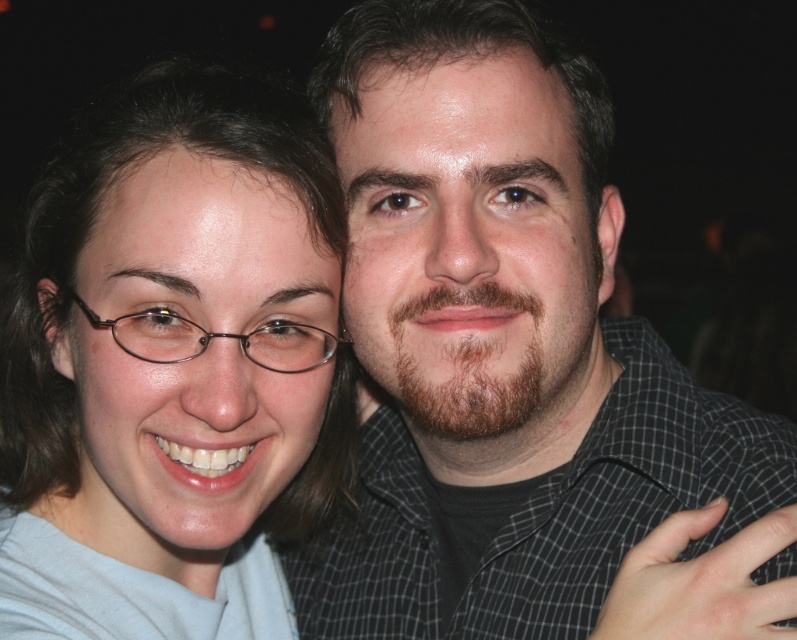
Question: Can you confirm if dark gray checkered shirt at center is thinner than matte gray shirt at center?

Choices:
 (A) yes
 (B) no

Answer: (B)

Question: Which of the following is the farthest from the observer?

Choices:
 (A) matte gray shirt at center
 (B) dark gray checkered shirt at center

Answer: (B)

Question: Which of the following is the farthest from the observer?

Choices:
 (A) matte gray shirt at center
 (B) dark gray checkered shirt at center

Answer: (B)

Question: Can you confirm if dark gray checkered shirt at center is thinner than matte gray shirt at center?

Choices:
 (A) yes
 (B) no

Answer: (B)

Question: Is dark gray checkered shirt at center below matte gray shirt at center?

Choices:
 (A) no
 (B) yes

Answer: (A)